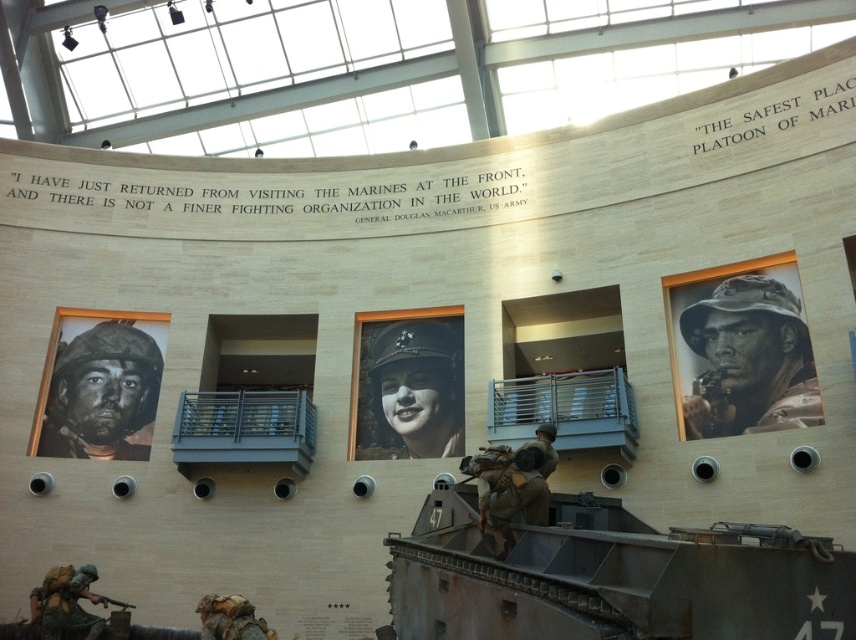
You are a security guard in the museum and need to place a new exhibit case between the black matte helmet at left and the matte black rifle at lower left. Based on their widths, which object should be placed closer to the center of the room to ensure the case fits properly?

The black matte helmet at left might be wider than the matte black rifle at lower left, so placing the helmet closer to the center would allow the exhibit case to fit between them appropriately.

You are a curator planning to place a new exhibit item at the point with coordinates point (100, 394). What object is located at that point?

The point (100, 394) corresponds to the black matte helmet at left.

You are a curator planning to install a new exhibit. You have two black matte helmets to display. The black matte helmet at right and the black matte helmet at left. You need to know which one is taller to decide placement. Which helmet is taller?

The black matte helmet at right is taller than the black matte helmet at left according to the description.